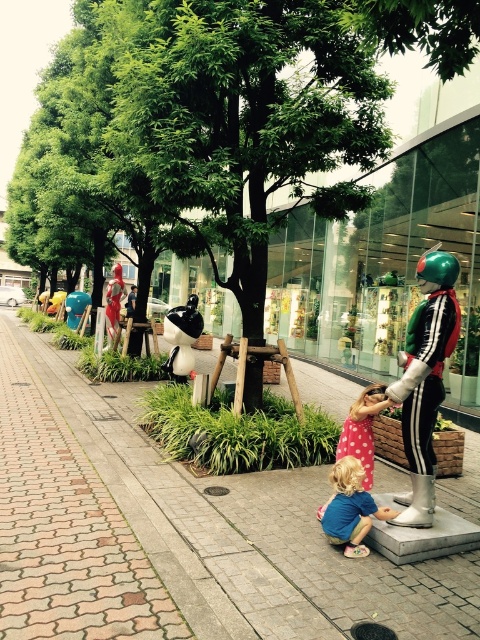
Can you confirm if brick pavement at center is positioned to the left of pink polka dot dress at center?

Correct, you'll find brick pavement at center to the left of pink polka dot dress at center.

Does brick pavement at center have a larger size compared to pink polka dot dress at center?

Indeed, brick pavement at center has a larger size compared to pink polka dot dress at center.

Which is in front, point (88, 403) or point (360, 440)?

Point (360, 440) is more forward.

Where is `brick pavement at center`? brick pavement at center is located at coordinates (245, 532).

Who is taller, shiny metallic robot at center right or pink polka dot dress at center?

shiny metallic robot at center right

Is point (415, 470) positioned before point (354, 410)?

Yes, it is.

Who is more forward, (437, 307) or (357, 432)?

Positioned in front is point (437, 307).

Locate an element on the screen. The image size is (480, 640). shiny metallic robot at center right is located at coordinates (424, 378).

Can you confirm if blue cotton shirt at lower center is bigger than pink polka dot dress at center?

Yes, blue cotton shirt at lower center is bigger than pink polka dot dress at center.

Is blue cotton shirt at lower center to the right of pink polka dot dress at center from the viewer's perspective?

In fact, blue cotton shirt at lower center is to the left of pink polka dot dress at center.

The height and width of the screenshot is (640, 480). Describe the element at coordinates (350, 508) in the screenshot. I see `blue cotton shirt at lower center` at that location.

Image resolution: width=480 pixels, height=640 pixels. I want to click on blue cotton shirt at lower center, so click(x=350, y=508).